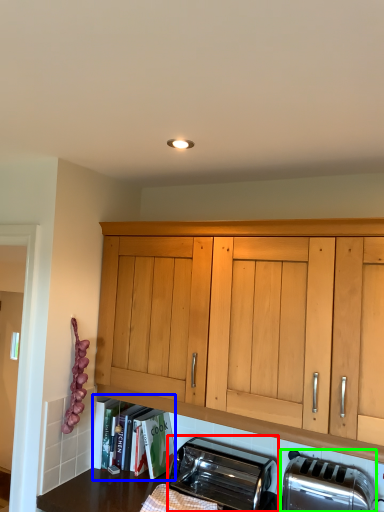
Question: Which is farther away from toaster (highlighted by a red box)? shelf (highlighted by a blue box) or toaster (highlighted by a green box)?

Choices:
 (A) shelf
 (B) toaster

Answer: (A)